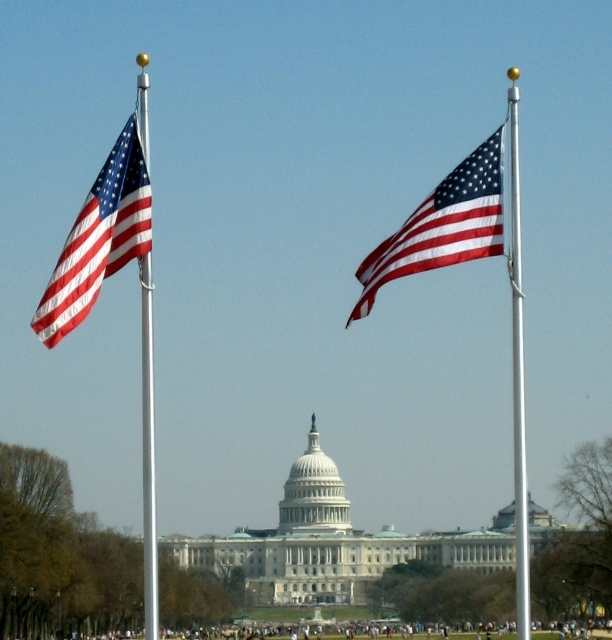
You are standing in front of the United States Capitol building and want to take a photo that includes both the Capitol dome and the two American flags in the foreground. You notice two specific points marked on your camera screen at coordinates point (422,227) and point (147,595). Which point is closer to you, the photographer?

Point (422,227) is closer to you than point (147,595) because it is further to the viewer in the image.

You are standing in front of the United States Capitol building and see the shiny metallic flag at center and the silver metallic flag pole at right. Which object is positioned to the left of the other?

The shiny metallic flag at center is positioned to the left of the silver metallic flag pole at right.